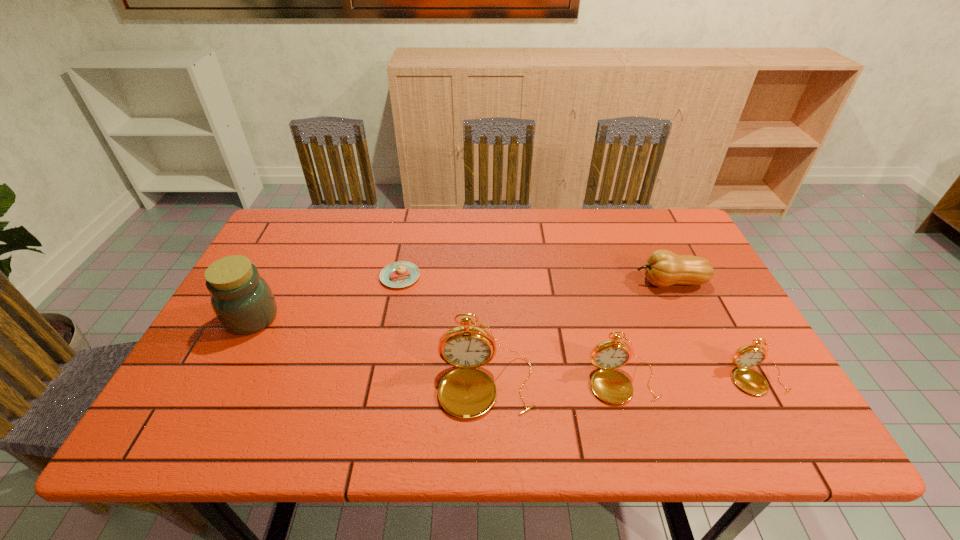
Where is `free spot at the right edge of the desktop`? free spot at the right edge of the desktop is located at coordinates (706, 298).

In the image, there is a desktop. Where is `vacant space at the far left corner`? vacant space at the far left corner is located at coordinates (275, 251).

Where is `vacant area that lies between the fourth object from left to right and the shortest pocket watch`? The width and height of the screenshot is (960, 540). vacant area that lies between the fourth object from left to right and the shortest pocket watch is located at coordinates (690, 380).

Locate an element on the screen. vacant point located between the leftmost pocket watch and the gourd is located at coordinates (578, 334).

Identify the location of empty space between the fourth shortest object and the leftmost pocket watch. (555, 384).

Where is `free space between the fourth nearest object and the tallest pocket watch`? The width and height of the screenshot is (960, 540). free space between the fourth nearest object and the tallest pocket watch is located at coordinates (369, 352).

Find the location of a particular element. The width and height of the screenshot is (960, 540). vacant point located between the second pocket watch from right to left and the leftmost pocket watch is located at coordinates (555, 384).

Locate an element on the screen. empty space that is in between the rightmost pocket watch and the fourth object from left to right is located at coordinates (690, 380).

Where is `empty space that is in between the fourth shortest object and the third object from left to right`? empty space that is in between the fourth shortest object and the third object from left to right is located at coordinates (555, 384).

Identify the location of empty space that is in between the gourd and the tallest pocket watch. The height and width of the screenshot is (540, 960). (578, 334).